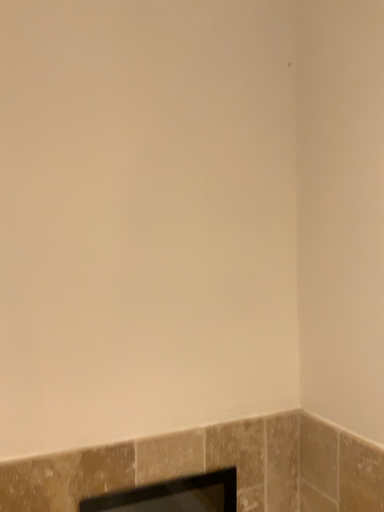
Find the location of a particular element. The width and height of the screenshot is (384, 512). black glass fireplace at lower center is located at coordinates click(173, 495).

The height and width of the screenshot is (512, 384). Describe the element at coordinates (173, 495) in the screenshot. I see `black glass fireplace at lower center` at that location.

Where is `black glass fireplace at lower center`? black glass fireplace at lower center is located at coordinates [173, 495].